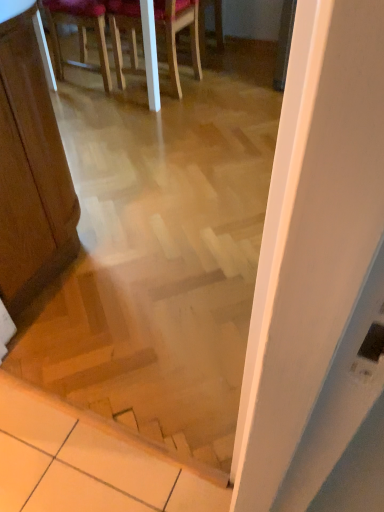
The height and width of the screenshot is (512, 384). Find the location of `free space below wooden stairs at center (from a real-world perspective)`. free space below wooden stairs at center (from a real-world perspective) is located at coordinates (94, 397).